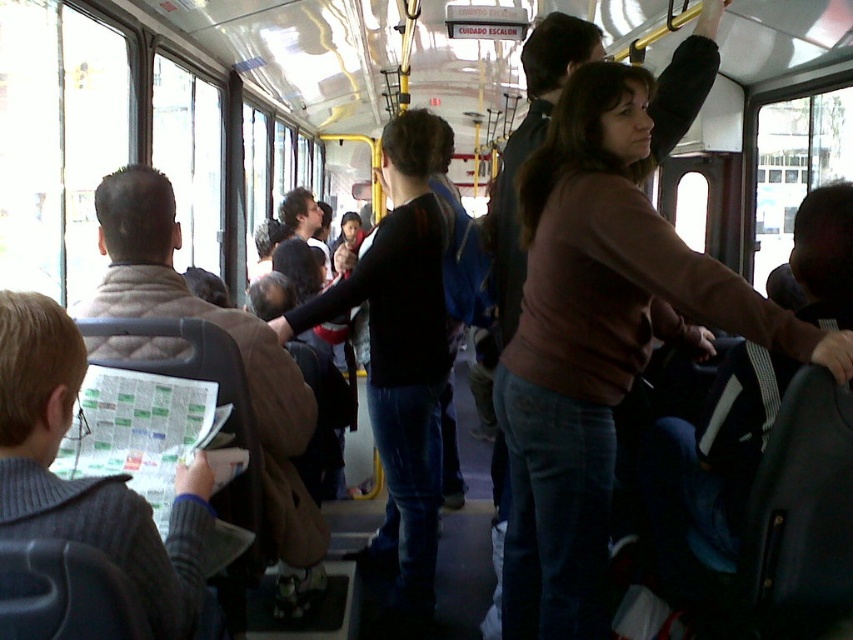
Question: Considering the real-world distances, which object is farthest from the gray knitted sweater at left?

Choices:
 (A) dark blue jeans at center
 (B) brown matte sweater at upper center

Answer: (A)

Question: Can you confirm if brown matte sweater at upper center is wider than gray knitted sweater at left?

Choices:
 (A) no
 (B) yes

Answer: (B)

Question: Which point is closer to the camera taking this photo?

Choices:
 (A) (398, 564)
 (B) (550, 568)

Answer: (B)

Question: Does brown matte sweater at upper center appear over gray knitted sweater at left?

Choices:
 (A) no
 (B) yes

Answer: (B)

Question: Which point appears closest to the camera in this image?

Choices:
 (A) (49, 458)
 (B) (410, 620)

Answer: (A)

Question: Is brown matte sweater at upper center bigger than dark blue jeans at center?

Choices:
 (A) yes
 (B) no

Answer: (A)